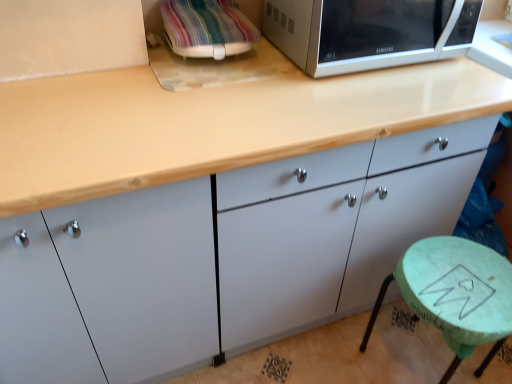
Find the location of `empty space that is ontop of green marble stool at lower right`. empty space that is ontop of green marble stool at lower right is located at coordinates (463, 279).